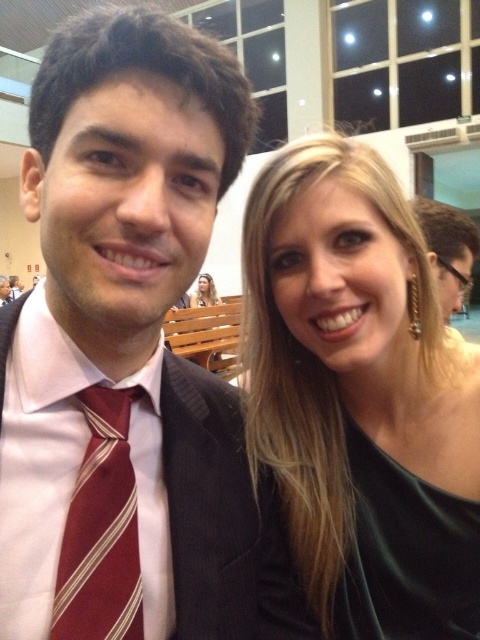
You are a photographer at a formal event. You need to adjust the lighting so that both the matte black suit at left and the maroon striped tie at center are equally visible. Given their widths, which object should you focus on to ensure proper exposure?

The matte black suit at left is wider than the maroon striped tie at center. To ensure proper exposure for both, focus on the matte black suit at left since its larger surface area will require more light adjustment.

You are a photographer at a formal event. You need to adjust the lighting so that the matte black suit at left and the matte black hair at upper center are both well lit. Which object requires more upward adjustment of the light source to ensure proper illumination?

The matte black suit at left is taller than the matte black hair at upper center, so the light source needs to be raised higher to illuminate the taller matte black suit at left properly.